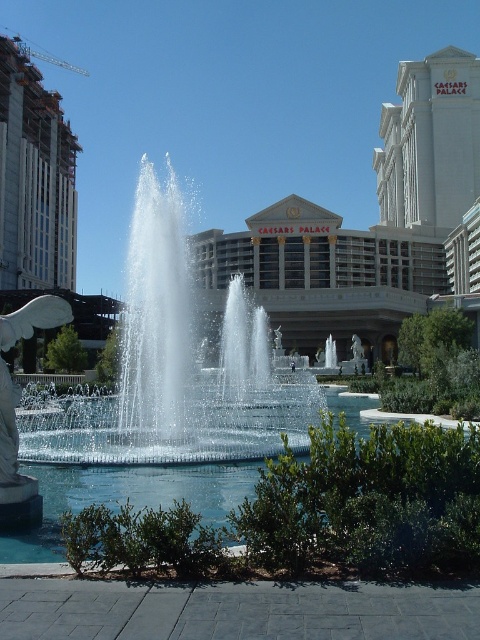
You are standing at the entrance of Caesars Palace and want to take a photo of both the clear glass water at center and the white marble statue at left. The camera you have can only focus on objects within 60 meters. Will both objects be in focus?

The clear glass water at center is 59.07 meters away from white marble statue at left. Since the distance between them is within the camera focus range of 60 meters, both objects will be in focus.

You are a tour guide at Caesars Palace and want to inform visitors about the clear glass water at center and the white marble statue at left. Can you explain how the statue is positioned relative to the water?

The clear glass water at center is positioned over the white marble statue at left, meaning the statue is located beneath the water in this arrangement.

You are standing at the entrance of Caesars Palace and want to take a photo of the fountain. You notice two points marked on the ground in front of you. The first point is labeled as point at position (228, 285) and the second is labeled as point at position (8, 420). Which point should you stand on to ensure that the fountain is fully visible in your photo without any obstructions?

You should stand on point at position (8, 420) because point at position (228, 285) is behind it, meaning standing on the latter would block the view of the fountain.